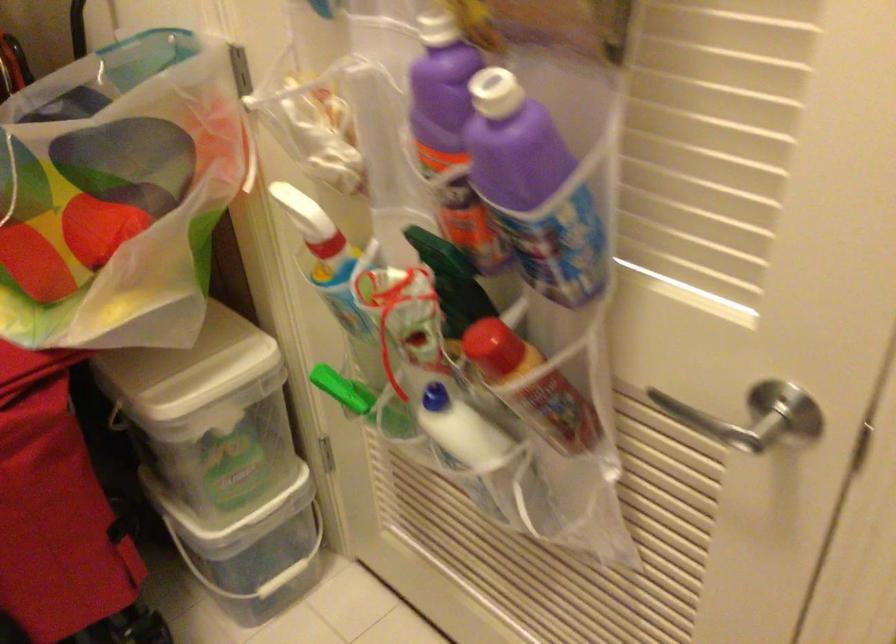
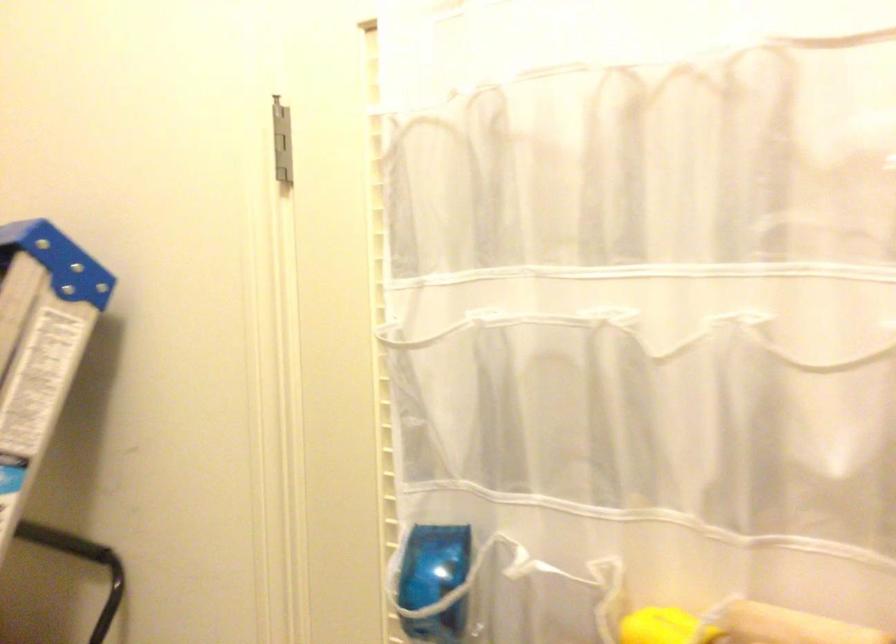
Question: The first image is from the beginning of the video and the second image is from the end. How did the camera likely rotate when shooting the video?

Choices:
 (A) Left
 (B) Right
 (C) Up
 (D) Down

Answer: (C)